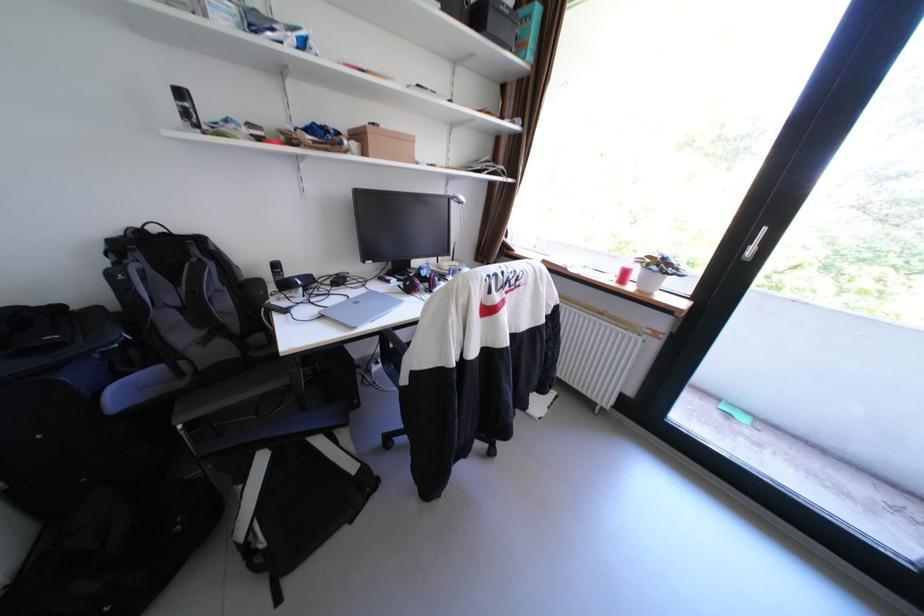
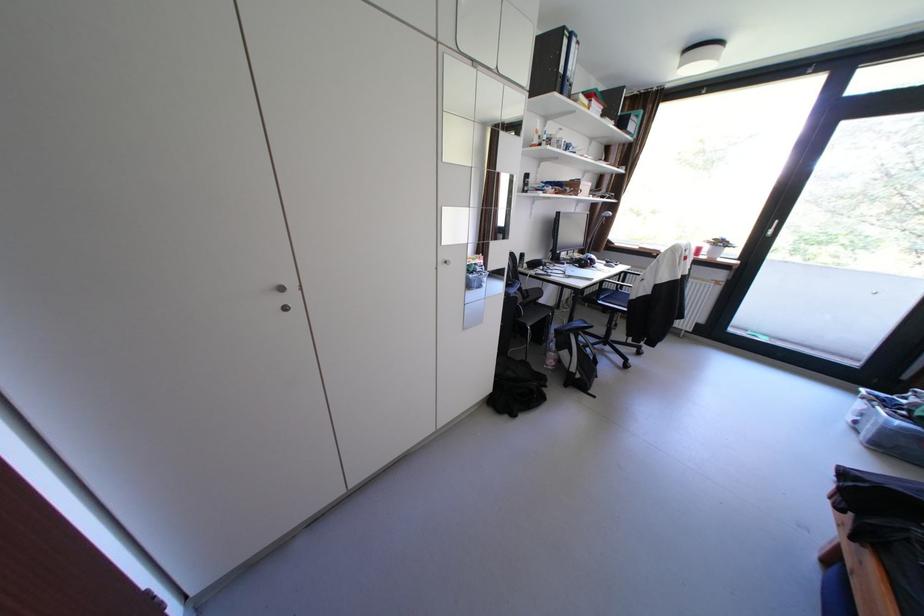
Where in the second image is the point corresponding to point (399, 282) from the first image?

(574, 264)